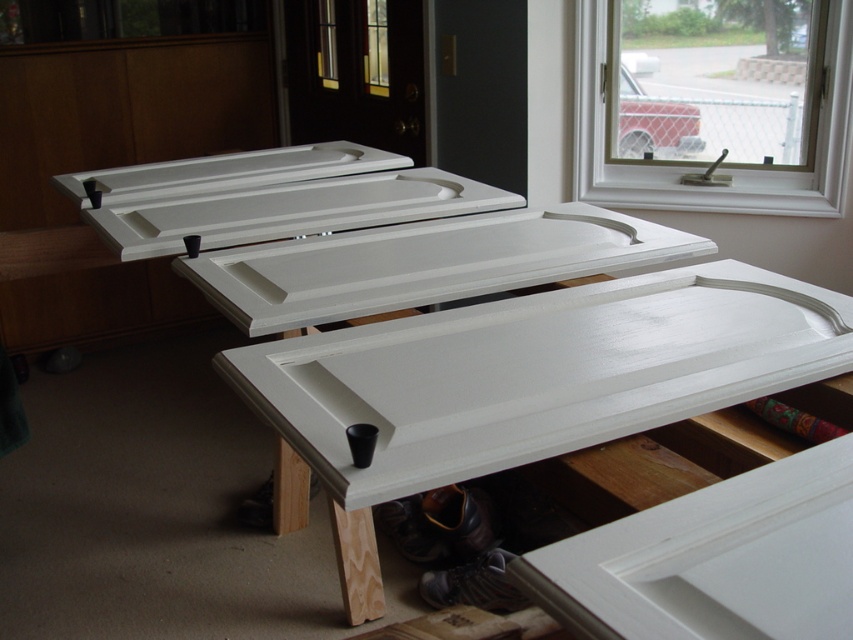
You are an interior designer assessing the layout of a room. You need to determine if the white painted wood door at center can fit through the white plastic window at upper right. Based on their widths, can the door fit through the window?

The white painted wood door at center is wider than the white plastic window at upper right, so it cannot fit through the window.

You are standing in a room where there are white painted wood door at center and white plastic window at upper right. Which object is located higher up in the room?

The white plastic window at upper right is located higher up in the room than the white painted wood door at center.

You are standing in a room where you need to move a 5 feet long ladder from the left side to the right side of the room. There is a white painted wood door at center and a white plastic window at upper right. Can you safely move the ladder without hitting any objects?

The white painted wood door at center is 4.49 feet away from the white plastic window at upper right. Since the ladder is 5 feet long, it is longer than the distance between the two objects, so moving it might cause contact. Therefore, you cannot safely move the ladder without hitting the white painted wood door at center or the white plastic window at upper right.